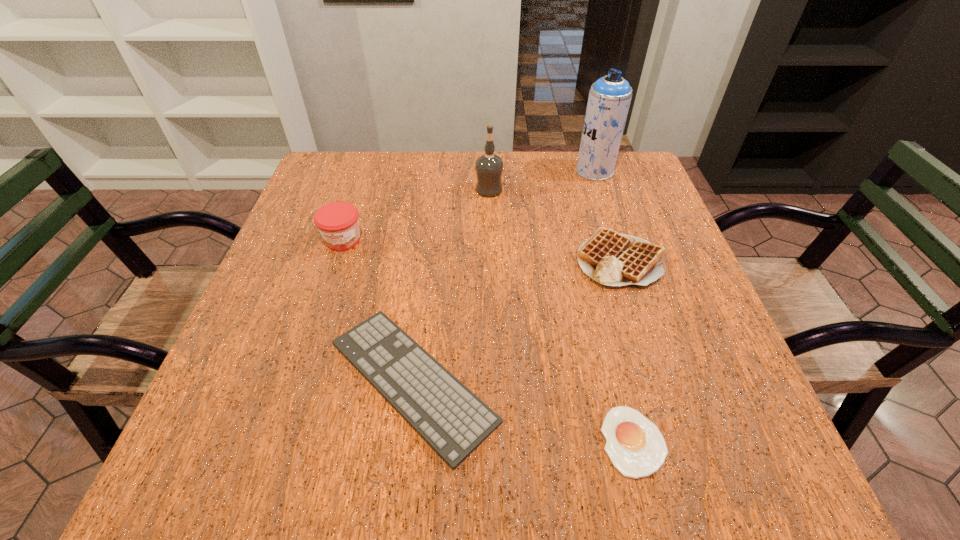
The height and width of the screenshot is (540, 960). I want to click on the tallest object, so click(609, 99).

Identify the location of aerosol can. (609, 99).

You are a GUI agent. You are given a task and a screenshot of the screen. Output one action in this format:
    pyautogui.click(x=<x>, y=<y>)
    Task: Click on the vodka
    Image resolution: width=960 pixels, height=540 pixels.
    Given the screenshot: What is the action you would take?
    pyautogui.click(x=489, y=167)

Where is `the fifth nearest object`? The height and width of the screenshot is (540, 960). the fifth nearest object is located at coordinates (489, 167).

Locate an element on the screen. the fourth shortest object is located at coordinates point(338,223).

You are a GUI agent. You are given a task and a screenshot of the screen. Output one action in this format:
    pyautogui.click(x=<x>, y=<y>)
    Task: Click on the waffle
    The width and height of the screenshot is (960, 540).
    Given the screenshot: What is the action you would take?
    pyautogui.click(x=613, y=259)

Where is `computer keyboard`? The height and width of the screenshot is (540, 960). computer keyboard is located at coordinates (445, 413).

Locate an element on the screen. This screenshot has height=540, width=960. the shortest object is located at coordinates (636, 447).

Where is `vacant space positioned on the front of the aerosol can`? The width and height of the screenshot is (960, 540). vacant space positioned on the front of the aerosol can is located at coordinates (614, 232).

You are a GUI agent. You are given a task and a screenshot of the screen. Output one action in this format:
    pyautogui.click(x=<x>, y=<y>)
    Task: Click on the vacant space situated on the front label of the vodka
    The image size is (960, 540).
    Given the screenshot: What is the action you would take?
    pyautogui.click(x=338, y=190)